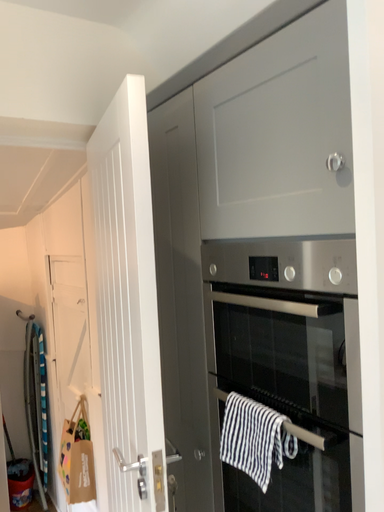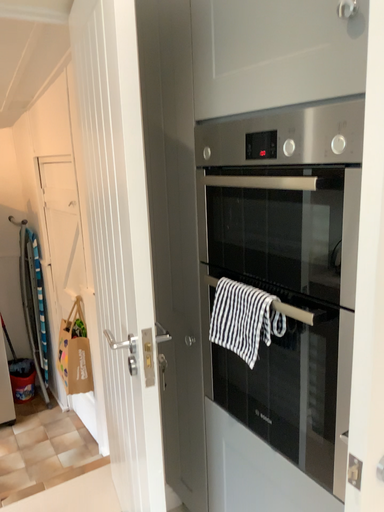
Question: Which way did the camera rotate in the video?

Choices:
 (A) rotated downward
 (B) rotated upward

Answer: (A)